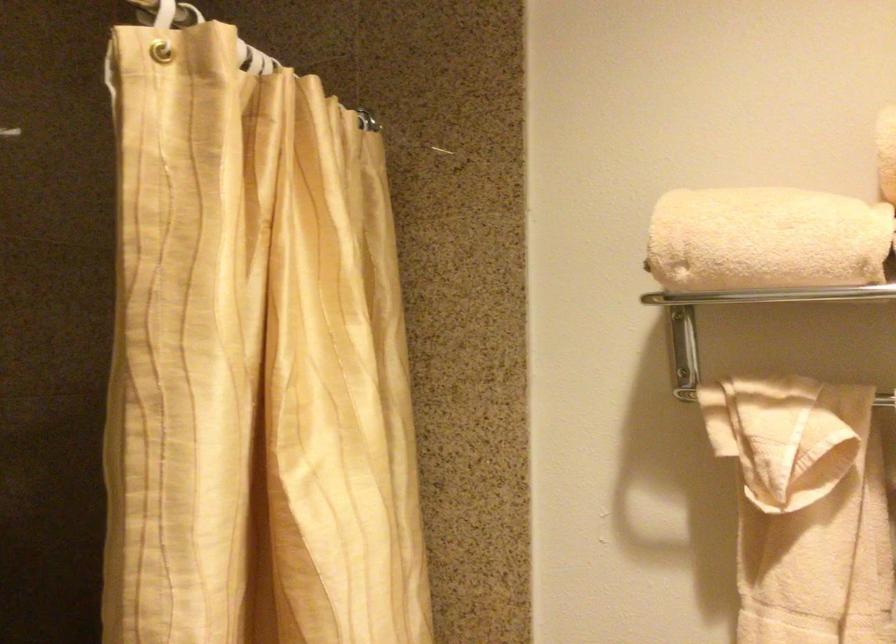
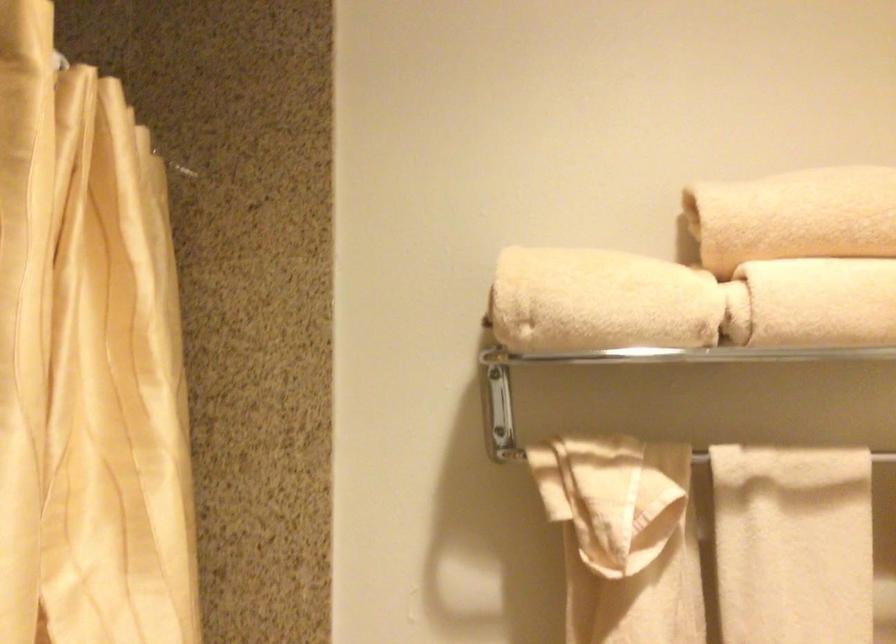
The point at [752,241] is marked in the first image. Where is the corresponding point in the second image?

(599, 301)